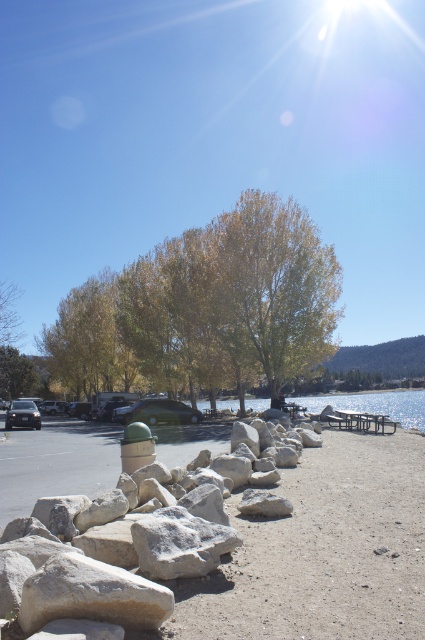
You are planning to set up a picnic area for a group of people. The gray rough stone at lower left and the metallic silver picnic table at center are both in the way of the setup. Which object should you move to clear more space?

You should move the gray rough stone at lower left because it is positioned over the metallic silver picnic table at center, meaning it is closer to the picnic area and obstructing more space.

You are standing at the point marked by the coordinates point (136, 445) in the image. What object is located exactly at that point?

The green matte hydrant at center is located exactly at point (136, 445).

You are a hiker who has just arrived at the lakeside parking area. You see a golden textured tree at center and a green matte hydrant at center. Which object is closer to the left edge of the parking lot?

The golden textured tree at center is positioned on the left side of green matte hydrant at center, so it is closer to the left edge of the parking lot.